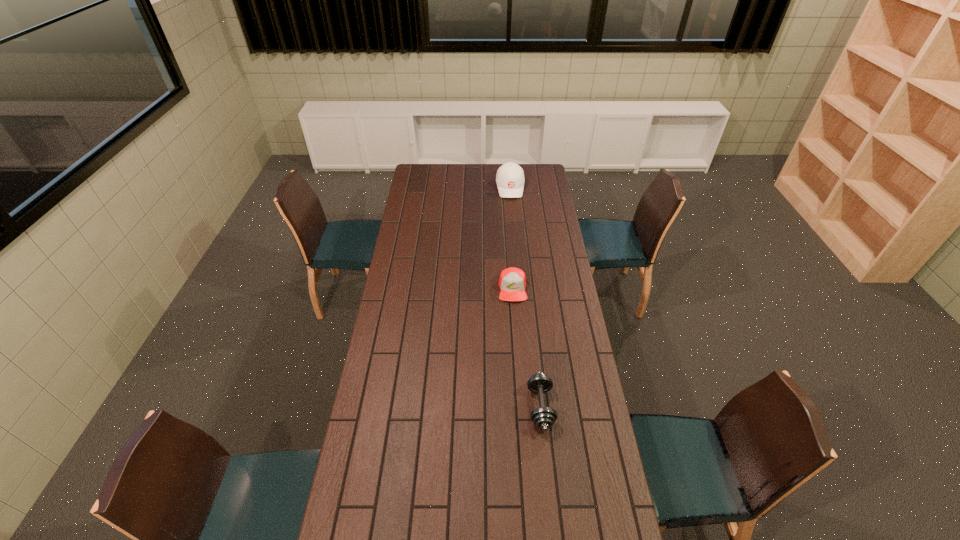
Locate an element on the screen. The height and width of the screenshot is (540, 960). free location that satisfies the following two spatial constraints: 1. on the front-facing side of the nearest object; 2. on the left side of the second nearest object is located at coordinates (521, 407).

At what (x,y) coordinates should I click in order to perform the action: click on free space that satisfies the following two spatial constraints: 1. on the front-facing side of the dumbbell; 2. on the left side of the taller baseball cap. Please return your answer as a coordinate pair (x, y). Looking at the image, I should click on (530, 407).

Identify the location of free point that satisfies the following two spatial constraints: 1. on the front-facing side of the farther baseball cap; 2. on the right side of the nearest object. The width and height of the screenshot is (960, 540). (530, 407).

Image resolution: width=960 pixels, height=540 pixels. I want to click on blank space that satisfies the following two spatial constraints: 1. on the front-facing side of the dumbbell; 2. on the right side of the farther baseball cap, so point(530,407).